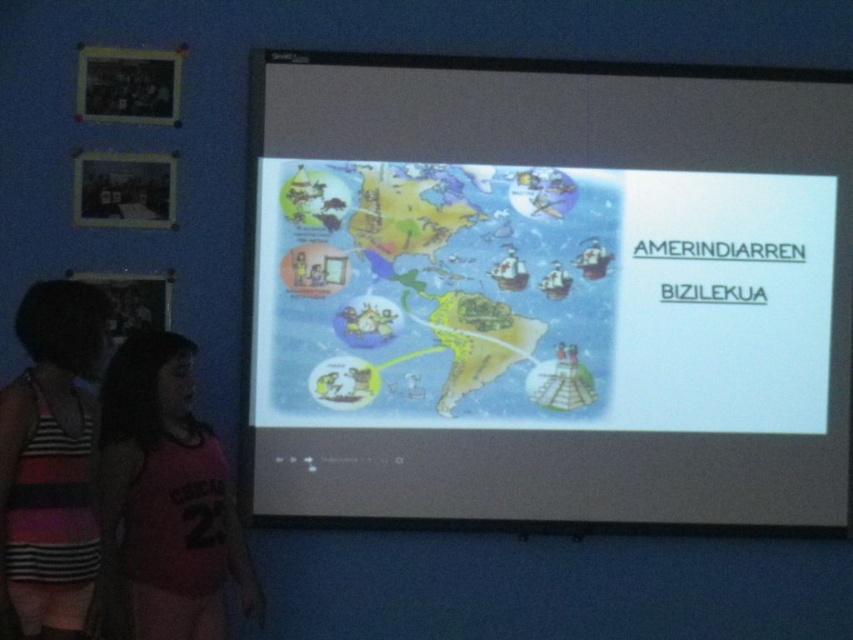
Is pink jersey at lower left closer to camera compared to striped fabric tank top at lower left?

No, it is behind striped fabric tank top at lower left.

Measure the distance between pink jersey at lower left and camera.

pink jersey at lower left and camera are 8.23 feet apart.

Does point (222, 496) come in front of point (3, 448)?

No, it is behind (3, 448).

At what (x,y) coordinates should I click in order to perform the action: click on pink jersey at lower left. Please return your answer as a coordinate pair (x, y). This screenshot has height=640, width=853. Looking at the image, I should click on (166, 499).

From the picture: Does white matte projection screen at center have a lesser width compared to pink jersey at lower left?

In fact, white matte projection screen at center might be wider than pink jersey at lower left.

At what (x,y) coordinates should I click in order to perform the action: click on white matte projection screen at center. Please return your answer as a coordinate pair (x, y). Looking at the image, I should click on (550, 292).

Is white matte projection screen at center taller than striped fabric tank top at lower left?

Yes.

Does point (515, 348) come in front of point (32, 355)?

No, it is behind (32, 355).

I want to click on white matte projection screen at center, so click(550, 292).